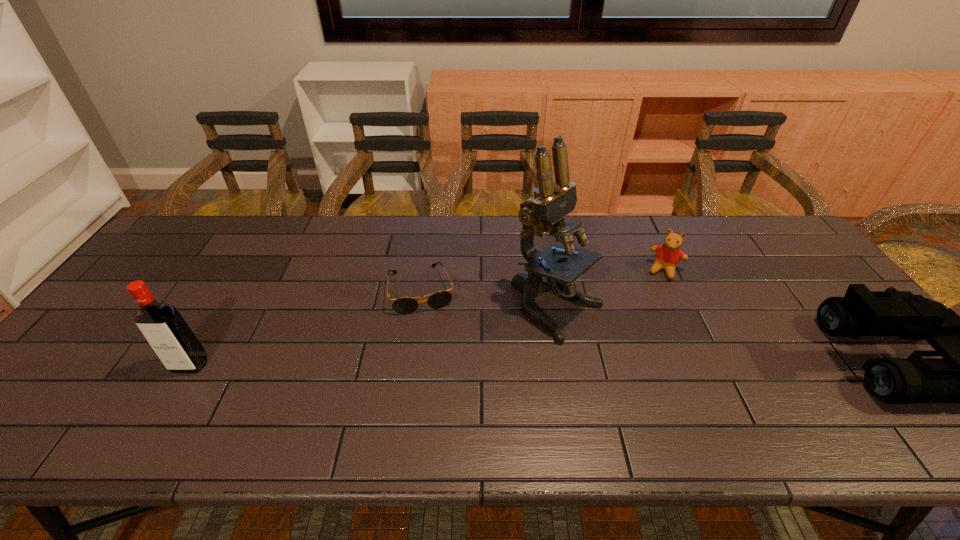
Find the location of `vacant space that satisfies the following two spatial constraints: 1. on the back side of the second shortest object; 2. on the right side of the microscope`. vacant space that satisfies the following two spatial constraints: 1. on the back side of the second shortest object; 2. on the right side of the microscope is located at coordinates point(551,270).